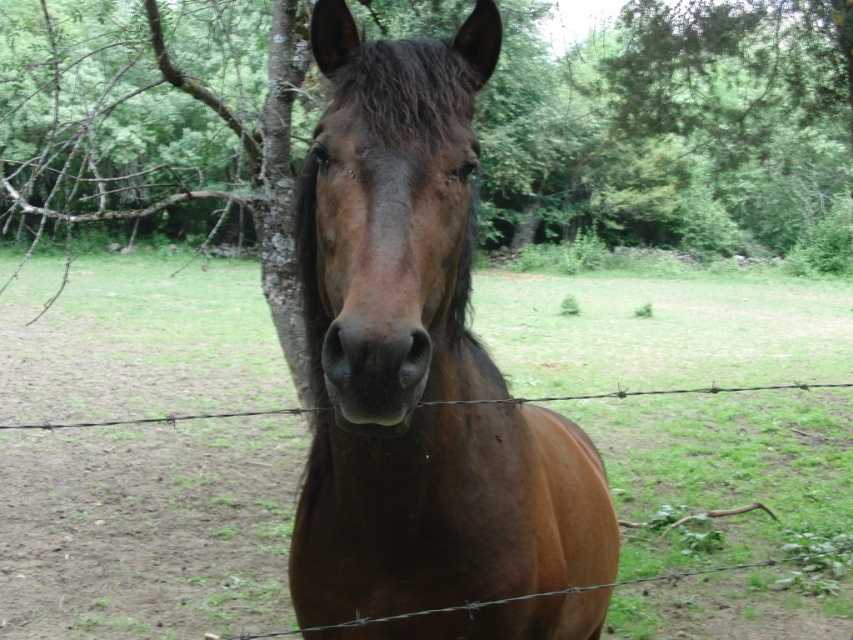
You are a photographer trying to capture the brown glossy horse at center in your shot. However, the green grass at center is blocking your view. Can you adjust your position to see the horse clearly?

The green grass at center is larger in size than the brown glossy horse at center, so the grass is blocking the view of the horse. To see the horse clearly, you need to move your position to avoid the obstruction caused by the larger grass.

You are a photographer trying to capture a shot of the brown glossy horse at center. You notice the green grass at center is blocking part of the horse. Can you determine if the grass is wider than the horse?

The green grass at center has a larger width than the brown glossy horse at center, so yes, the grass is wider and might be blocking the horse.